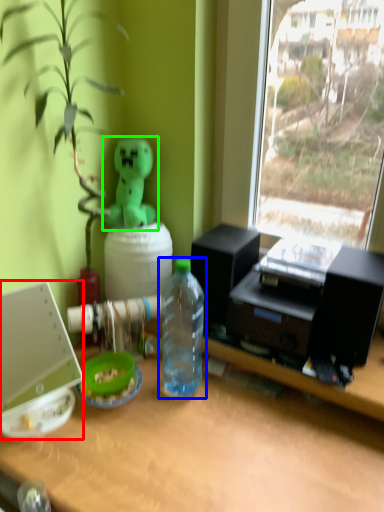
Question: Considering the real-world distances, which object is farthest from laptop (highlighted by a red box)? bottle (highlighted by a blue box) or toy (highlighted by a green box)?

Choices:
 (A) bottle
 (B) toy

Answer: (B)